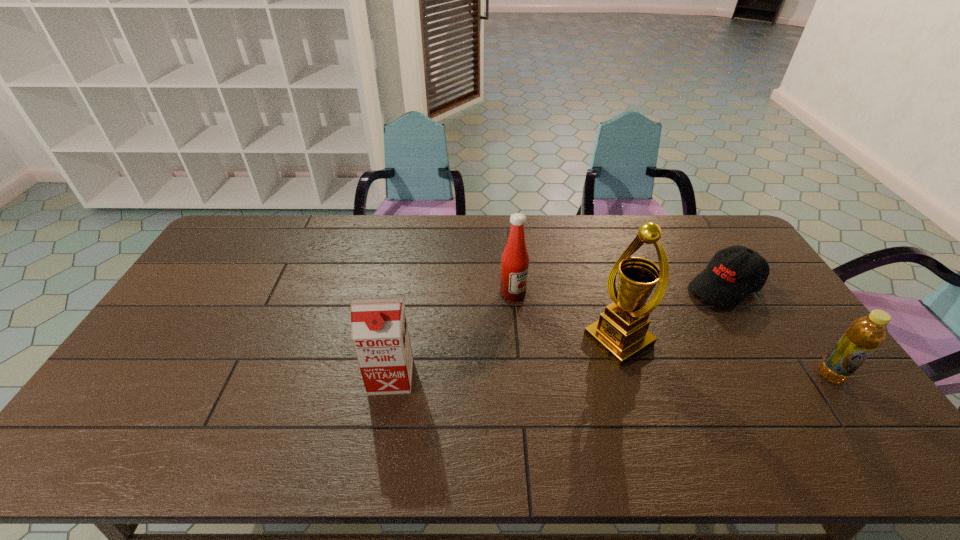
Find the location of a particular element. This screenshot has height=540, width=960. vacant space on the desktop that is between the soya milk and the second shortest object and is positioned on the front-facing side of the fourth object from right to left is located at coordinates (596, 376).

Locate an element on the screen. The width and height of the screenshot is (960, 540). vacant spot on the desktop that is between the leftmost object and the second shortest object and is positioned on the front-facing side of the baseball cap is located at coordinates (588, 376).

This screenshot has height=540, width=960. What are the coordinates of `free space on the desktop that is between the leftmost object and the second shortest object and is positioned on the front-facing side of the tallest object` in the screenshot? It's located at pyautogui.click(x=560, y=376).